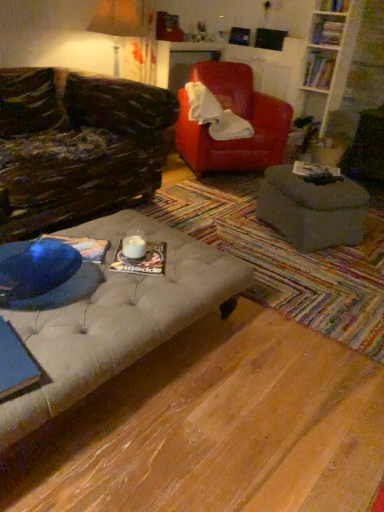
Where is `blank space situated above matte paper book at center, arranged as the second book when viewed from the left (from a real-world perspective)`? The width and height of the screenshot is (384, 512). blank space situated above matte paper book at center, arranged as the second book when viewed from the left (from a real-world perspective) is located at coordinates (148, 251).